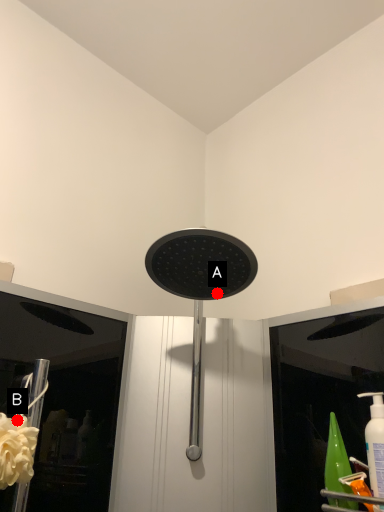
Question: Two points are circled on the image, labeled by A and B beside each circle. Which point is closer to the camera?

Choices:
 (A) A is closer
 (B) B is closer

Answer: (B)